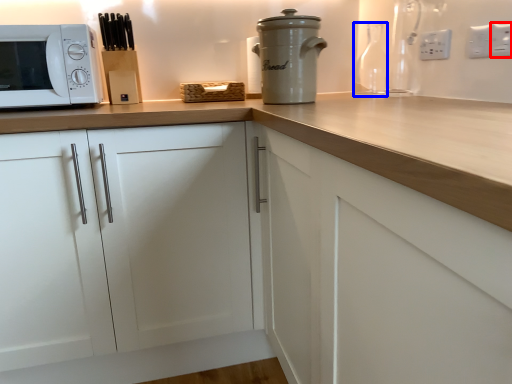
Question: Which object appears farthest to the camera in this image, electric outlet (highlighted by a red box) or bottle (highlighted by a blue box)?

Choices:
 (A) electric outlet
 (B) bottle

Answer: (B)